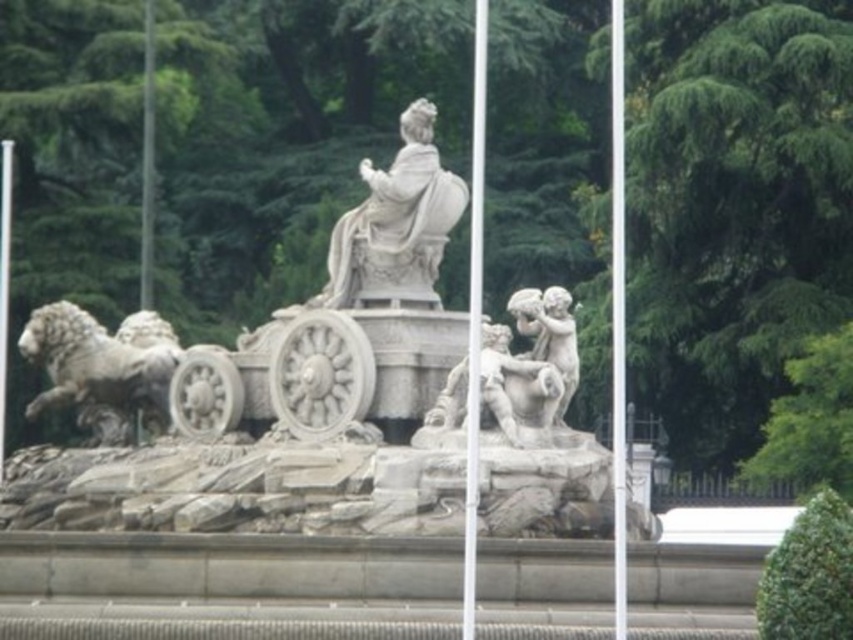
Question: Which object is farther from the camera taking this photo?

Choices:
 (A) white marble cherub at center
 (B) gray stone lion at left

Answer: (B)

Question: Considering the relative positions of white metal flag pole at center and white marble cherub at center in the image provided, where is white metal flag pole at center located with respect to white marble cherub at center?

Choices:
 (A) right
 (B) left

Answer: (B)

Question: Which of the following is the closest to the observer?

Choices:
 (A) gray stone lion at left
 (B) white marble cherub at center

Answer: (B)

Question: Is gray stone lion at left above metallic flag pole at center?

Choices:
 (A) no
 (B) yes

Answer: (A)

Question: Can you confirm if white marble statue at center is bigger than white metal flag pole at center?

Choices:
 (A) yes
 (B) no

Answer: (B)

Question: Which point is closer to the camera taking this photo?

Choices:
 (A) (624, 212)
 (B) (397, 360)
 (C) (469, 445)
 (D) (523, 305)

Answer: (C)